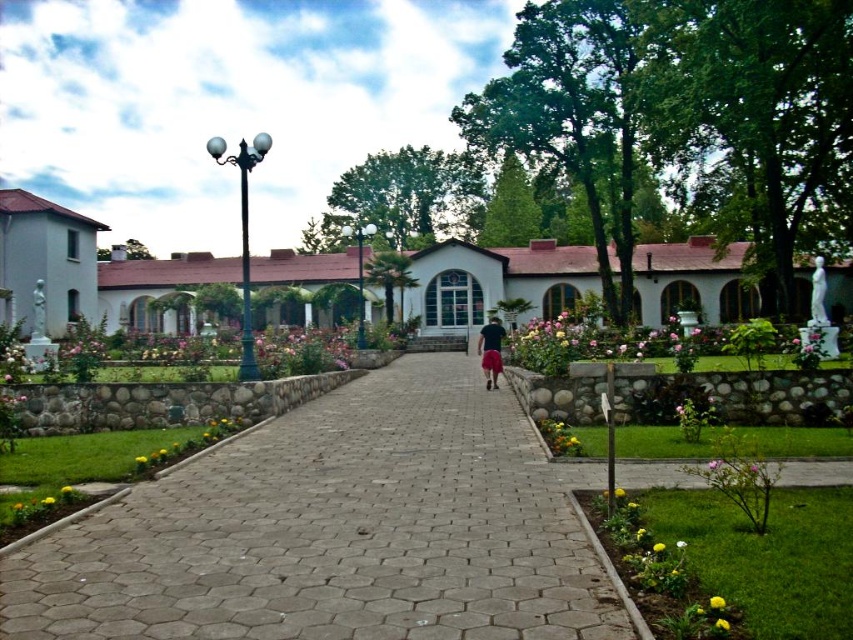
Question: Is gray hexagonal paving stone at center below black fabric shorts at center?

Choices:
 (A) yes
 (B) no

Answer: (A)

Question: Among these points, which one is nearest to the camera?

Choices:
 (A) (474, 472)
 (B) (488, 348)

Answer: (A)

Question: Is gray hexagonal paving stone at center below black fabric shorts at center?

Choices:
 (A) yes
 (B) no

Answer: (A)

Question: Is gray hexagonal paving stone at center wider than black fabric shorts at center?

Choices:
 (A) no
 (B) yes

Answer: (B)